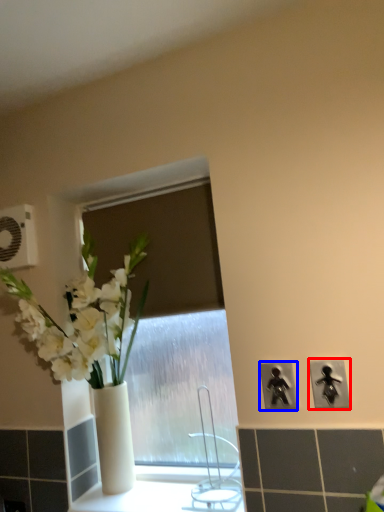
Question: Which object appears closest to the camera in this image, electric outlet (highlighted by a red box) or electric outlet (highlighted by a blue box)?

Choices:
 (A) electric outlet
 (B) electric outlet

Answer: (A)